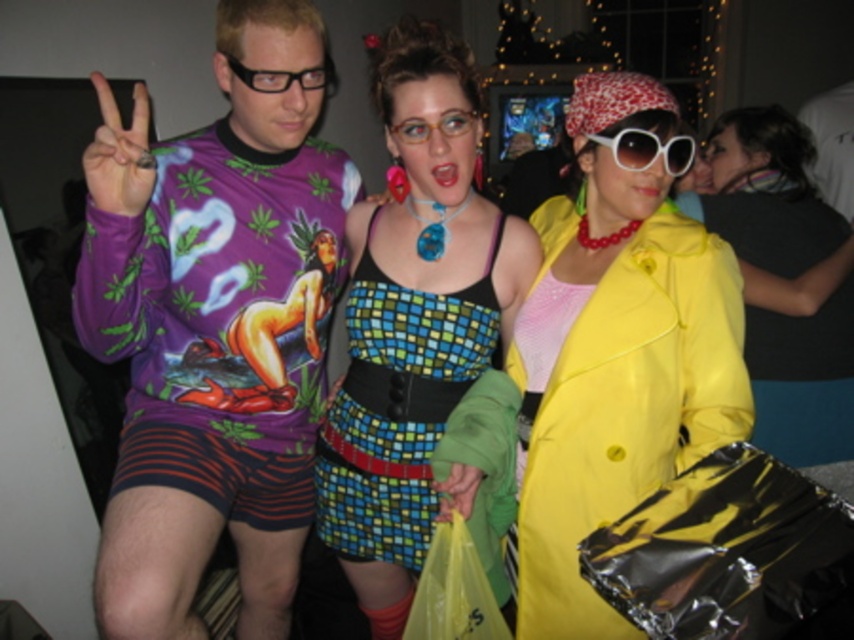
You are standing in the room and want to locate the yellow satin coat at center. According to the scene description, where should you look?

The yellow satin coat at center is located at the 2D coordinates point (785, 280).

You are a photographer at the party and want to take a closeup shot of the multicolored mosaic dress at center and the white plastic sunglasses at center. Since the camera can only focus on one object at a time, which object should you focus on to ensure it fills the frame more?

The multicolored mosaic dress at center is bigger than the white plastic sunglasses at center, so focusing on the multicolored mosaic dress at center will ensure it fills the frame more.

You are a photographer at a party and want to take a photo of the yellow satin coat at center and the white plastic sunglasses at center. To ensure both are in focus, you need to know their relative positions. Which object is located to the right of the other?

The yellow satin coat at center is positioned on the right side of white plastic sunglasses at center.